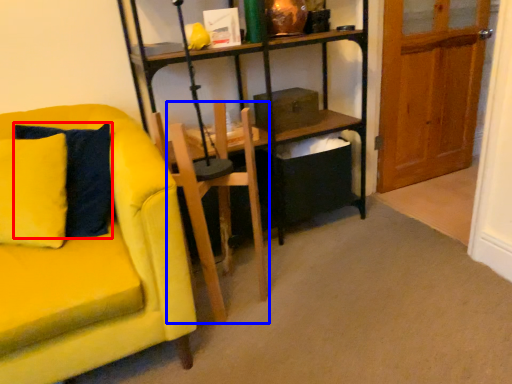
Question: Which of the following is the closest to the observer, pillow (highlighted by a red box) or armchair (highlighted by a blue box)?

Choices:
 (A) pillow
 (B) armchair

Answer: (A)